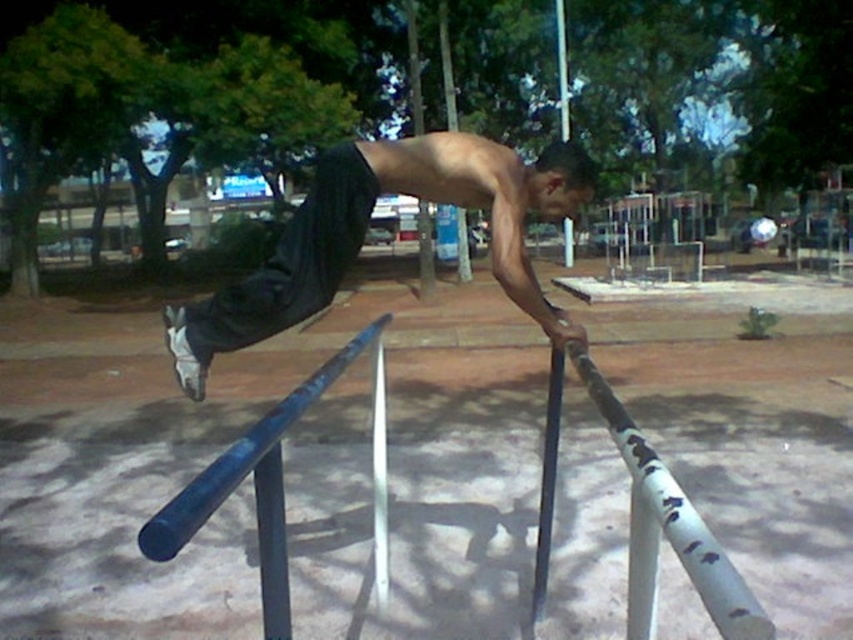
Is point (280, 266) more distant than point (564, 45)?

That is False.

You are a GUI agent. You are given a task and a screenshot of the screen. Output one action in this format:
    pyautogui.click(x=<x>, y=<y>)
    Task: Click on the black matte pants at center
    The image size is (853, 640).
    Given the screenshot: What is the action you would take?
    pyautogui.click(x=364, y=228)

Where is `black matte pants at center`? black matte pants at center is located at coordinates (364, 228).

Does muscle at center lie behind smooth metal pole at center?

Yes, muscle at center is further from the viewer.

Which is behind, point (495, 150) or point (550, 476)?

Point (495, 150)

Where is `muscle at center`? This screenshot has height=640, width=853. muscle at center is located at coordinates (450, 170).

Can you confirm if smooth metal pole at center is bigger than white painted wood pole at upper center?

No, smooth metal pole at center is not bigger than white painted wood pole at upper center.

Between smooth metal pole at center and white painted wood pole at upper center, which one has less height?

smooth metal pole at center is shorter.

Which is in front, point (540, 550) or point (561, 108)?

Point (540, 550)

Image resolution: width=853 pixels, height=640 pixels. Identify the location of smooth metal pole at center. (547, 481).